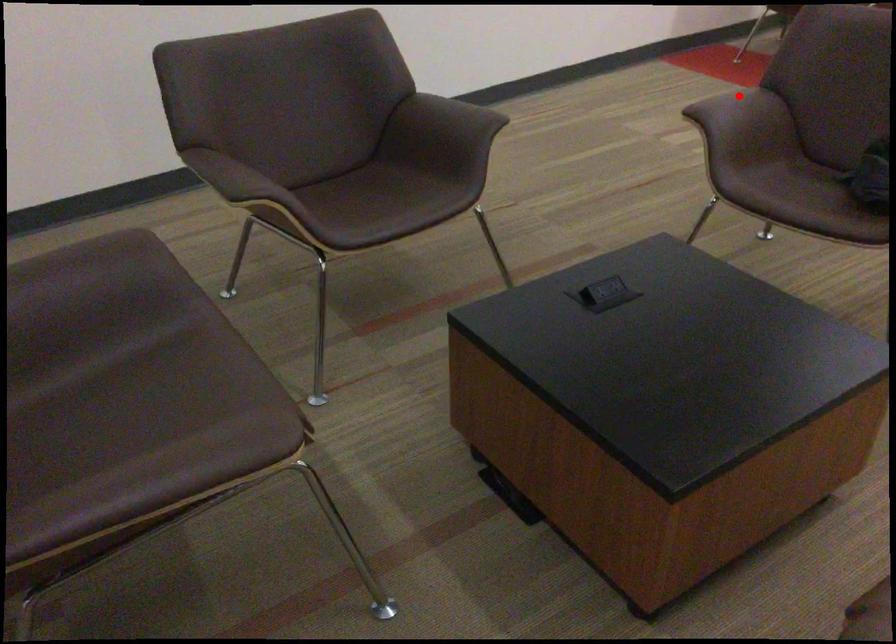
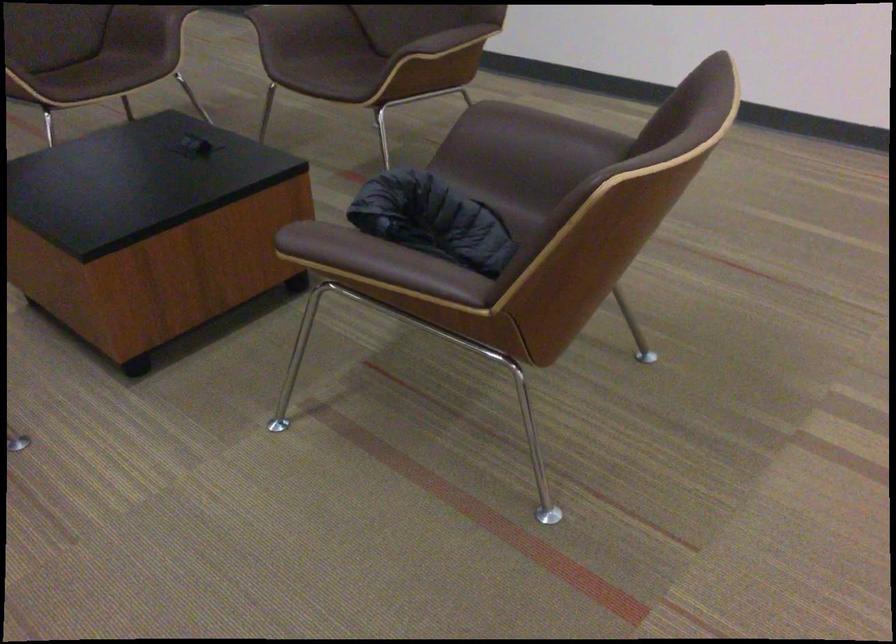
Locate, in the second image, the point that corresponds to the highlighted location in the first image.

(545, 128)